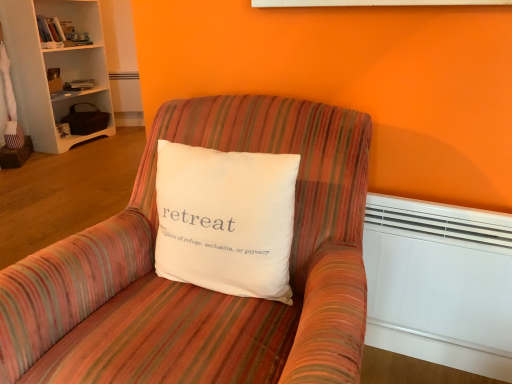
Question: Does white plastic heater at lower right lie behind white cotton pillow at center?

Choices:
 (A) yes
 (B) no

Answer: (A)

Question: Is white plastic heater at lower right smaller than white cotton pillow at center?

Choices:
 (A) yes
 (B) no

Answer: (A)

Question: Is white plastic heater at lower right looking in the opposite direction of white cotton pillow at center?

Choices:
 (A) yes
 (B) no

Answer: (B)

Question: Is white plastic heater at lower right aimed at white cotton pillow at center?

Choices:
 (A) yes
 (B) no

Answer: (B)

Question: Is white cotton pillow at center surrounded by white plastic heater at lower right?

Choices:
 (A) yes
 (B) no

Answer: (B)

Question: From the image's perspective, relative to white wood bookcase at upper left, is striped fabric chair at center above or below?

Choices:
 (A) below
 (B) above

Answer: (A)

Question: Looking at the image, does striped fabric chair at center seem bigger or smaller compared to white wood bookcase at upper left?

Choices:
 (A) big
 (B) small

Answer: (A)

Question: Is point (236, 130) closer or farther from the camera than point (70, 104)?

Choices:
 (A) farther
 (B) closer

Answer: (B)

Question: Based on their positions, is striped fabric chair at center located to the left or right of white wood bookcase at upper left?

Choices:
 (A) left
 (B) right

Answer: (B)

Question: From a real-world perspective, is striped fabric chair at center positioned above or below white cotton pillow at center?

Choices:
 (A) below
 (B) above

Answer: (A)

Question: Is striped fabric chair at center wider or thinner than white cotton pillow at center?

Choices:
 (A) thin
 (B) wide

Answer: (B)

Question: Looking at the image, does striped fabric chair at center seem bigger or smaller compared to white cotton pillow at center?

Choices:
 (A) small
 (B) big

Answer: (B)

Question: Is striped fabric chair at center situated inside white cotton pillow at center or outside?

Choices:
 (A) inside
 (B) outside

Answer: (B)

Question: From a real-world perspective, is white plastic heater at lower right positioned above or below white wood bookcase at upper left?

Choices:
 (A) below
 (B) above

Answer: (A)

Question: In terms of height, does white plastic heater at lower right look taller or shorter compared to white wood bookcase at upper left?

Choices:
 (A) tall
 (B) short

Answer: (B)